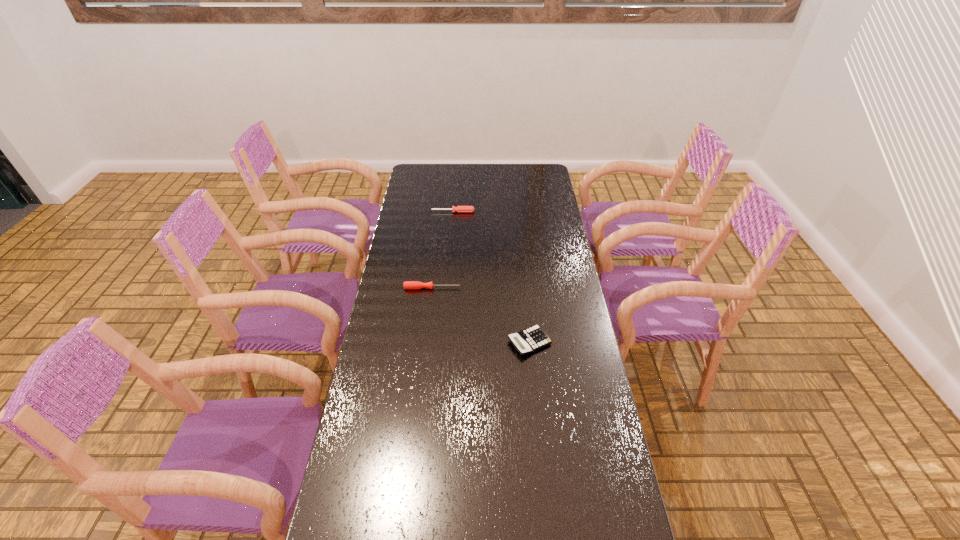
At what (x,y) coordinates should I click in order to perform the action: click on free space at the right edge of the desktop. Please return your answer as a coordinate pair (x, y). Image resolution: width=960 pixels, height=540 pixels. Looking at the image, I should click on (565, 271).

Identify the location of blank space at the far left corner of the desktop. (424, 174).

The image size is (960, 540). I want to click on free region at the far right corner of the desktop, so click(521, 180).

Identify the location of vacant area between the farthest object and the calculator. (492, 277).

Find the location of a particular element. free space between the farther screwdriver and the nearer screwdriver is located at coordinates (443, 249).

Locate an element on the screen. unoccupied position between the calculator and the second farthest object is located at coordinates (481, 315).

Where is `vacant space in between the second nearest object and the farther screwdriver`? vacant space in between the second nearest object and the farther screwdriver is located at coordinates (443, 249).

The height and width of the screenshot is (540, 960). Identify the location of vacant area that lies between the second nearest object and the nearest object. (481, 315).

This screenshot has height=540, width=960. In order to click on vacant space that's between the nearer screwdriver and the nearest object in this screenshot , I will do `click(481, 315)`.

At what (x,y) coordinates should I click in order to perform the action: click on vacant area that lies between the farther screwdriver and the nearest object. Please return your answer as a coordinate pair (x, y). Looking at the image, I should click on (492, 277).